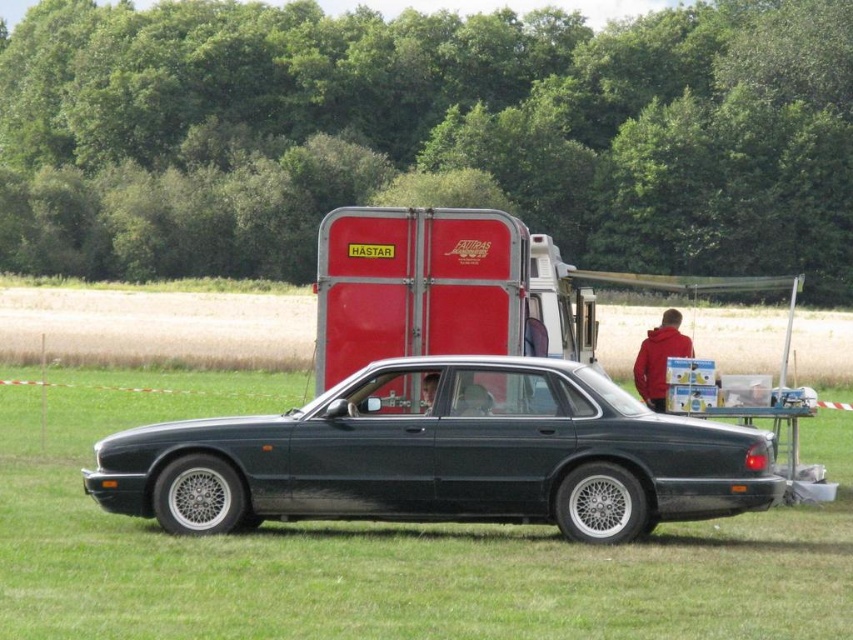
Question: Considering the relative positions of metallic dark green sedan at center and red fleece jacket at center in the image provided, where is metallic dark green sedan at center located with respect to red fleece jacket at center?

Choices:
 (A) right
 (B) left

Answer: (B)

Question: Can you confirm if metallic dark green sedan at center is positioned above red fleece jacket at center?

Choices:
 (A) no
 (B) yes

Answer: (A)

Question: Does metallic dark green sedan at center have a lesser width compared to red fleece jacket at center?

Choices:
 (A) yes
 (B) no

Answer: (B)

Question: Among these objects, which one is nearest to the camera?

Choices:
 (A) red fleece jacket at center
 (B) metallic dark green sedan at center

Answer: (B)

Question: Among these points, which one is nearest to the camera?

Choices:
 (A) (654, 346)
 (B) (708, 499)

Answer: (B)

Question: Which of the following is the closest to the observer?

Choices:
 (A) red fleece jacket at center
 (B) metallic dark green sedan at center

Answer: (B)